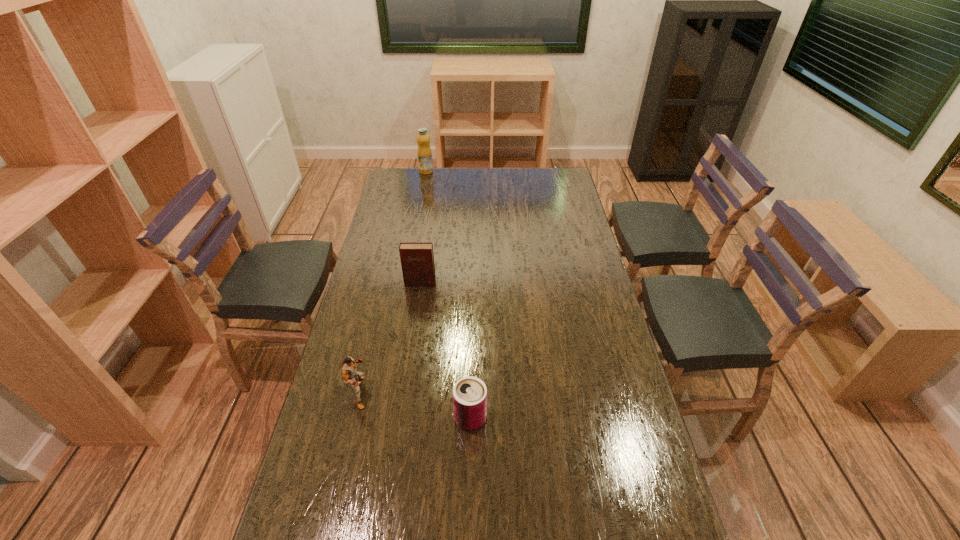
Where is `vacant space that is in between the puncher and the farthest object`? Image resolution: width=960 pixels, height=540 pixels. vacant space that is in between the puncher and the farthest object is located at coordinates (393, 282).

The height and width of the screenshot is (540, 960). Find the location of `empty location between the diary and the tallest object`. empty location between the diary and the tallest object is located at coordinates pos(423,227).

In order to click on object that stands as the second closest to the leftmost object in this screenshot , I will do `click(417, 259)`.

At what (x,y) coordinates should I click in order to perform the action: click on object that stands as the second closest to the fruit juice. Please return your answer as a coordinate pair (x, y). The height and width of the screenshot is (540, 960). Looking at the image, I should click on (348, 367).

Find the location of `free location that satisfies the following two spatial constraints: 1. on the front cover of the diary; 2. on the front-facing side of the puncher`. free location that satisfies the following two spatial constraints: 1. on the front cover of the diary; 2. on the front-facing side of the puncher is located at coordinates (404, 393).

Where is `free space that satisfies the following two spatial constraints: 1. on the front-facing side of the puncher; 2. on the right side of the can`? The width and height of the screenshot is (960, 540). free space that satisfies the following two spatial constraints: 1. on the front-facing side of the puncher; 2. on the right side of the can is located at coordinates (353, 418).

Find the location of `vacant area in the image that satisfies the following two spatial constraints: 1. on the front-facing side of the puncher; 2. on the left side of the can`. vacant area in the image that satisfies the following two spatial constraints: 1. on the front-facing side of the puncher; 2. on the left side of the can is located at coordinates (353, 418).

Locate an element on the screen. Image resolution: width=960 pixels, height=540 pixels. vacant area that satisfies the following two spatial constraints: 1. on the front cover of the diary; 2. on the front-facing side of the puncher is located at coordinates (404, 393).